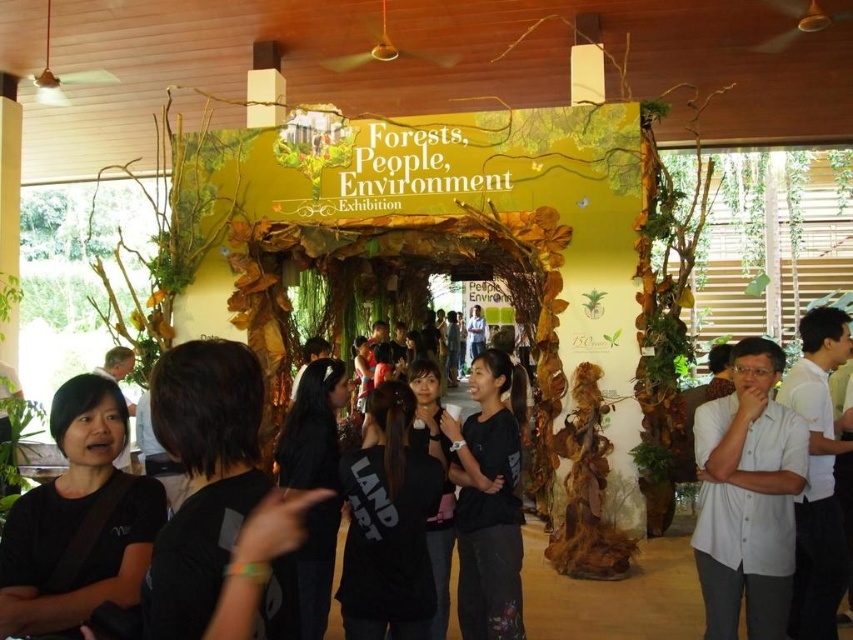
Consider the image. Is white shirt at center closer to camera compared to white shirt at right?

Yes, white shirt at center is closer to the viewer.

Is white shirt at center bigger than white shirt at right?

Yes.

Does point (715, 557) come behind point (816, 310)?

No, (715, 557) is closer to viewer.

Find the location of a particular element. white shirt at center is located at coordinates (747, 497).

Which of these two, black matte shirt at lower left or white shirt at right, stands shorter?

black matte shirt at lower left is shorter.

Between black matte shirt at lower left and white shirt at right, which one appears on the left side from the viewer's perspective?

black matte shirt at lower left is more to the left.

What do you see at coordinates (78, 520) in the screenshot? Image resolution: width=853 pixels, height=640 pixels. I see `black matte shirt at lower left` at bounding box center [78, 520].

Image resolution: width=853 pixels, height=640 pixels. Identify the location of black matte shirt at lower left. (78, 520).

Between black matte shirt at lower left and white shirt at center, which one has less height?

black matte shirt at lower left

Is black matte shirt at lower left further to camera compared to white shirt at center?

No.

Is point (120, 429) less distant than point (791, 428)?

That is True.

Where is `black matte shirt at lower left`? The width and height of the screenshot is (853, 640). black matte shirt at lower left is located at coordinates (78, 520).